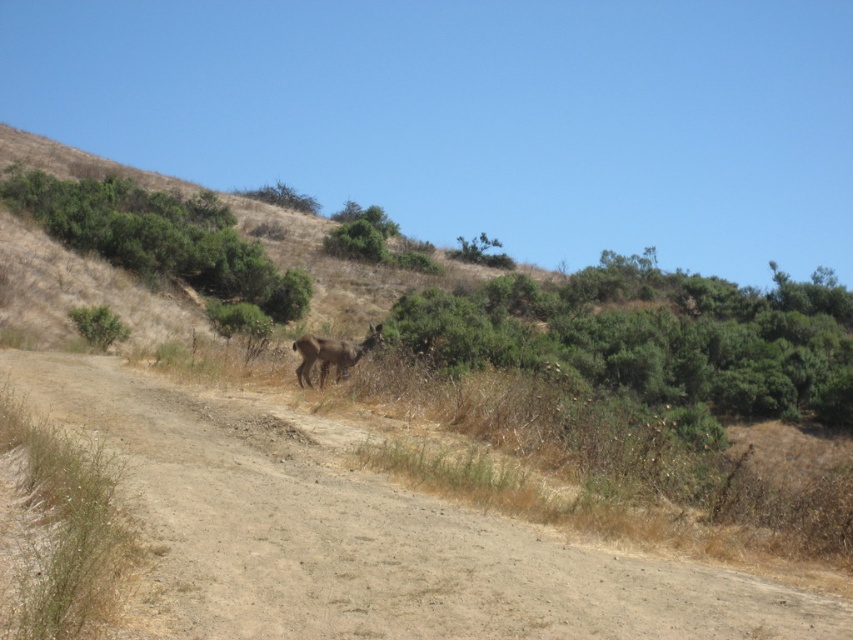
Is the position of brown dirt track at center more distant than that of brown furry deer at center?

That is False.

Does brown dirt track at center come in front of brown furry deer at center?

Yes, brown dirt track at center is in front of brown furry deer at center.

Which is behind, point (643, 573) or point (302, 346)?

The point (302, 346) is more distant.

This screenshot has height=640, width=853. I want to click on brown dirt track at center, so pyautogui.click(x=369, y=534).